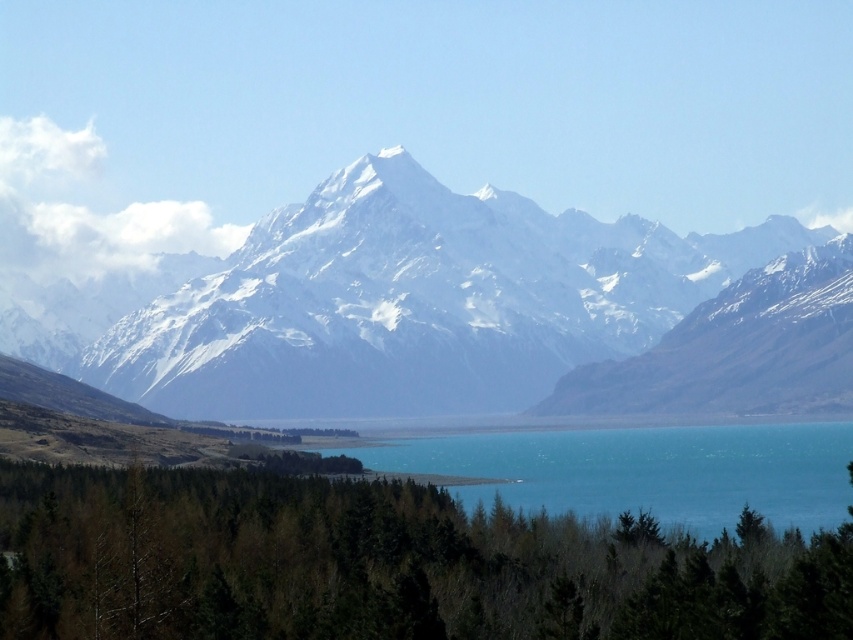
Question: Can you confirm if white snow-covered mountain range at upper center is wider than green matte trees at lower center?

Choices:
 (A) yes
 (B) no

Answer: (A)

Question: Is green matte trees at lower center wider than turquoise glassy water at center?

Choices:
 (A) yes
 (B) no

Answer: (A)

Question: Estimate the real-world distances between objects in this image. Which object is closer to the green matte trees at lower center?

Choices:
 (A) white snow-covered mountain range at upper center
 (B) turquoise glassy water at center

Answer: (B)

Question: Is white snow-covered mountain range at upper center smaller than turquoise glassy water at center?

Choices:
 (A) no
 (B) yes

Answer: (A)

Question: Considering the real-world distances, which object is closest to the turquoise glassy water at center?

Choices:
 (A) white snow-covered mountain range at upper center
 (B) green matte trees at lower center

Answer: (B)

Question: Which point is closer to the camera taking this photo?

Choices:
 (A) (59, 285)
 (B) (548, 467)
 (C) (558, 570)

Answer: (C)